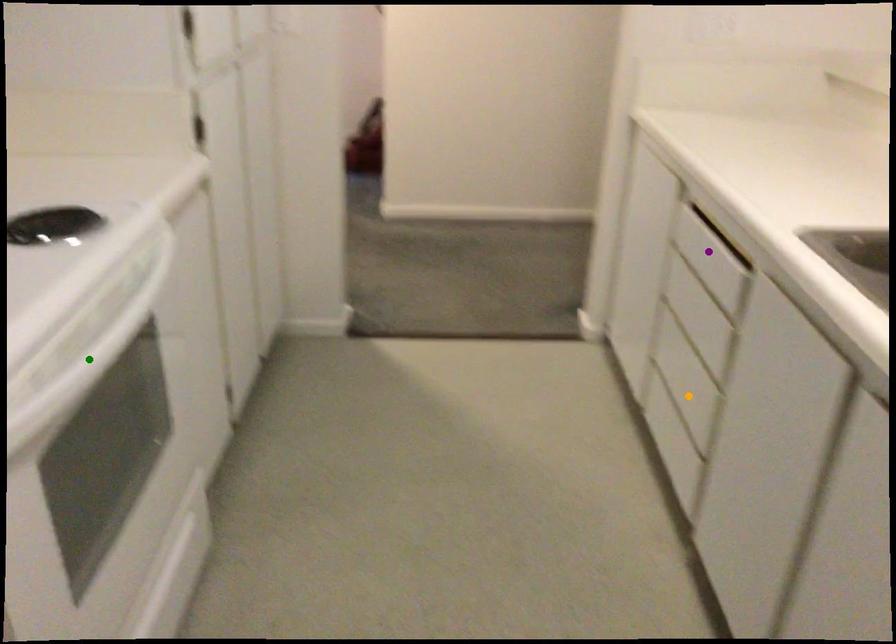
Order these from nearest to farthest:
- purple point
- green point
- orange point

green point < purple point < orange point